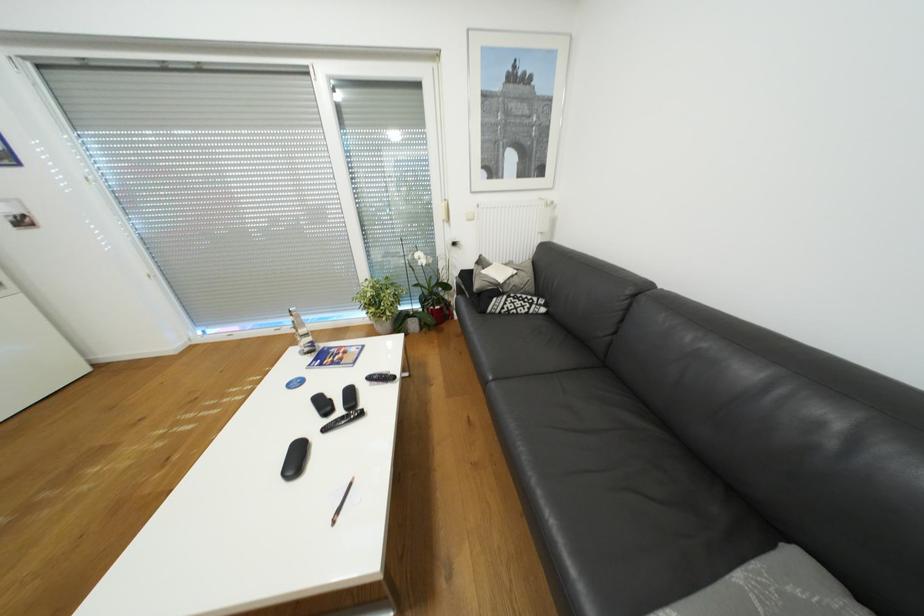
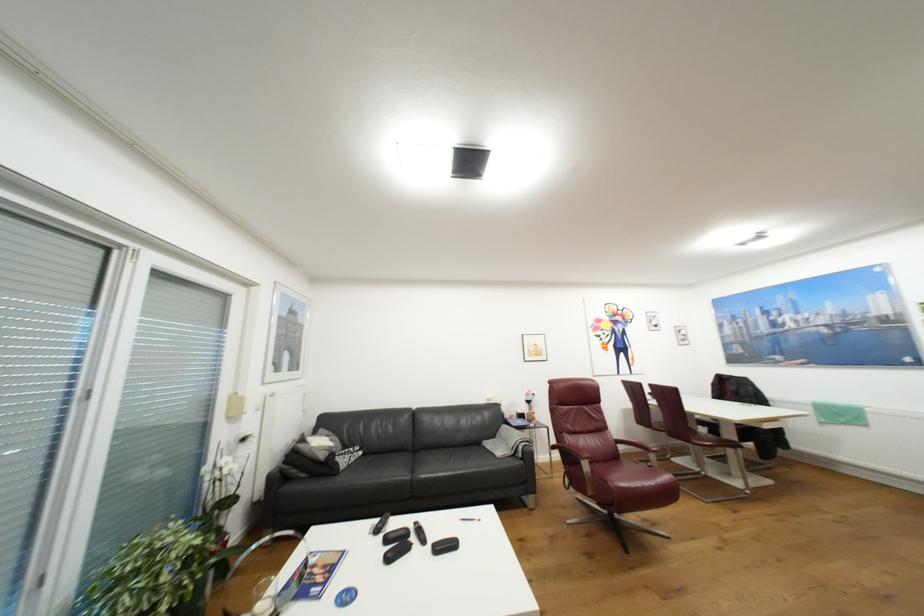
The point at (302, 383) is marked in the first image. Where is the corresponding point in the second image?

(354, 597)